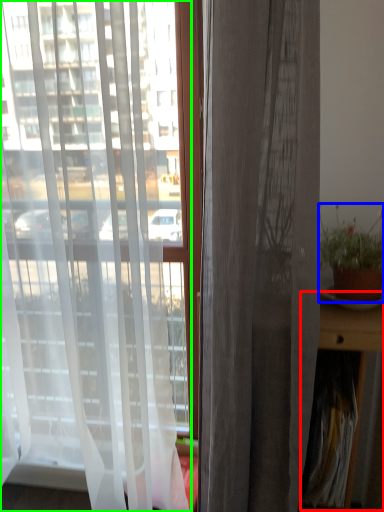
Question: Based on their relative distances, which object is farther from table (highlighted by a red box)? Choose from houseplant (highlighted by a blue box) and curtain (highlighted by a green box).

Choices:
 (A) houseplant
 (B) curtain

Answer: (B)